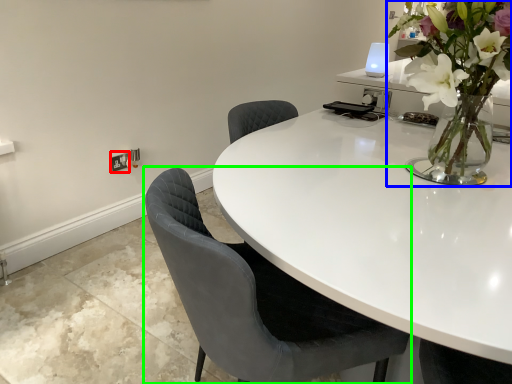
Question: Which is farther away from electric outlet (highlighted by a red box)? houseplant (highlighted by a blue box) or chair (highlighted by a green box)?

Choices:
 (A) houseplant
 (B) chair

Answer: (A)